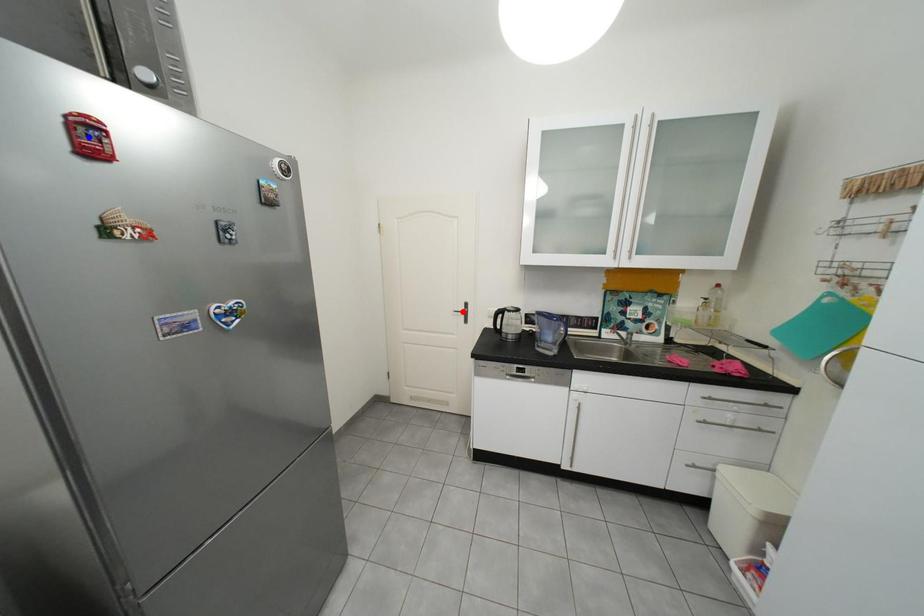
Question: Which of the two points in the image is closer to the camera?

Choices:
 (A) Blue point is closer.
 (B) Red point is closer.

Answer: (A)